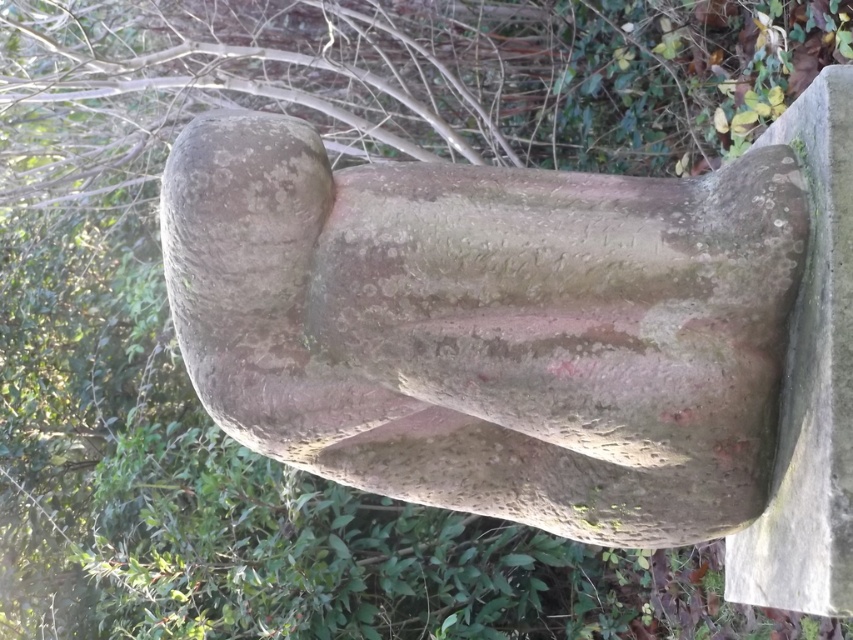
Question: Does speckled stone statue at center appear on the left side of speckled concrete bench at right?

Choices:
 (A) no
 (B) yes

Answer: (B)

Question: Does speckled stone statue at center lie in front of speckled concrete bench at right?

Choices:
 (A) no
 (B) yes

Answer: (A)

Question: Can you confirm if speckled stone statue at center is thinner than speckled concrete bench at right?

Choices:
 (A) no
 (B) yes

Answer: (A)

Question: Which of the following is the closest to the observer?

Choices:
 (A) speckled concrete bench at right
 (B) speckled stone statue at center

Answer: (A)